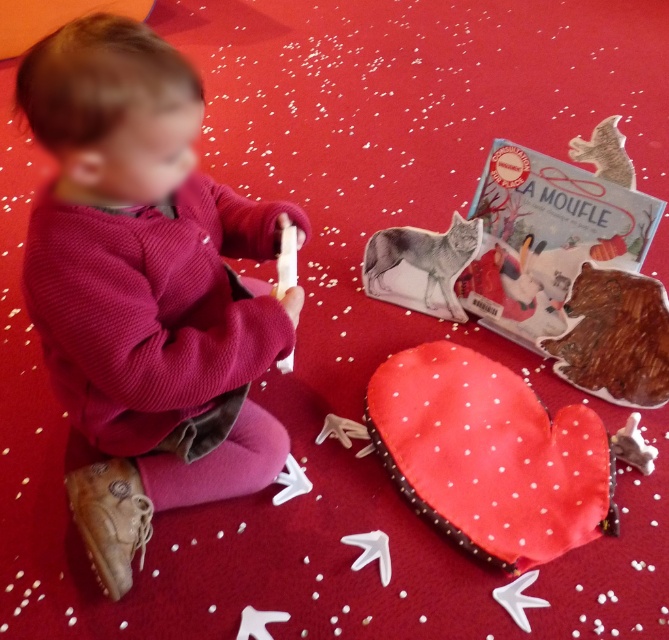
Is fuzzy gray wolf at center shorter than smooth beige mittens at lower center?

No, fuzzy gray wolf at center is not shorter than smooth beige mittens at lower center.

Which is in front, point (432, 264) or point (318, 438)?

Positioned in front is point (318, 438).

I want to click on fuzzy gray wolf at center, so click(419, 266).

You are a GUI agent. You are given a task and a screenshot of the screen. Output one action in this format:
    pyautogui.click(x=<x>, y=<y>)
    Task: Click on the fuzzy gray wolf at center
    The height and width of the screenshot is (640, 669).
    Given the screenshot: What is the action you would take?
    pyautogui.click(x=419, y=266)

Does fuzzy gray wolf at center appear under metallic silver bat at upper right?

Yes.

Looking at this image, can you confirm if fuzzy gray wolf at center is smaller than metallic silver bat at upper right?

Actually, fuzzy gray wolf at center might be larger than metallic silver bat at upper right.

Locate an element on the screen. The width and height of the screenshot is (669, 640). fuzzy gray wolf at center is located at coordinates (419, 266).

Can you confirm if metallic silver bat at upper right is positioned to the right of white fabric heart at lower center?

Correct, you'll find metallic silver bat at upper right to the right of white fabric heart at lower center.

In the scene shown: Is metallic silver bat at upper right positioned behind white fabric heart at lower center?

Yes, metallic silver bat at upper right is behind white fabric heart at lower center.

Find the location of `metallic silver bat at upper right`. metallic silver bat at upper right is located at coordinates (605, 152).